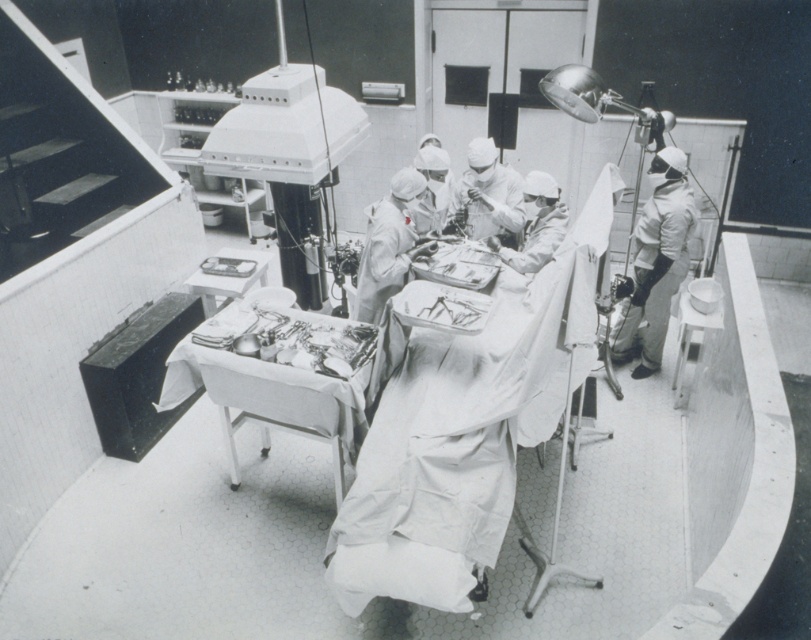
Who is shorter, metallic silver tray at center or white matte uniform at right?

Standing shorter between the two is metallic silver tray at center.

Where is `metallic silver tray at center`? Image resolution: width=811 pixels, height=640 pixels. metallic silver tray at center is located at coordinates (284, 376).

Does point (260, 445) come in front of point (685, 216)?

No.

Where is `metallic silver tray at center`? This screenshot has width=811, height=640. metallic silver tray at center is located at coordinates (284, 376).